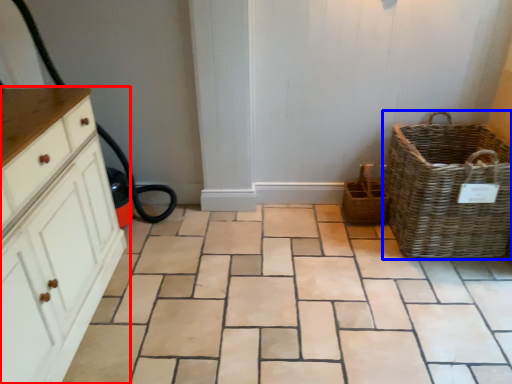
Question: Which point is further to the camera, chest of drawers (highlighted by a red box) or picnic basket (highlighted by a blue box)?

Choices:
 (A) chest of drawers
 (B) picnic basket

Answer: (B)